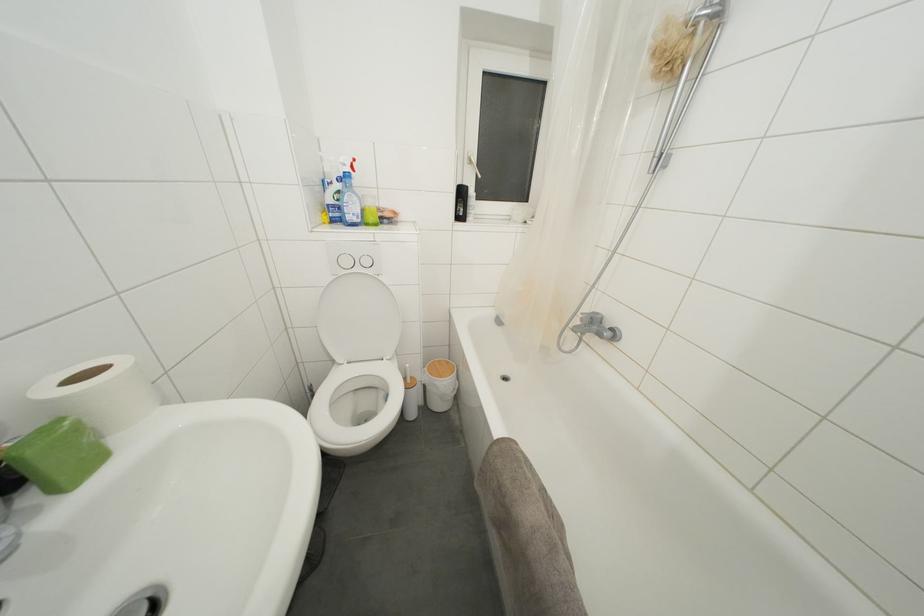
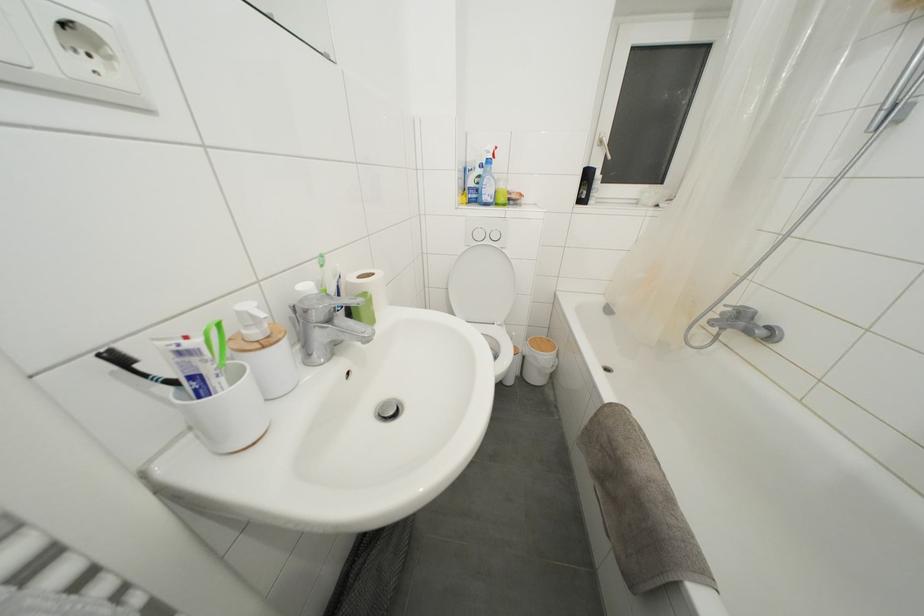
Find the pixel in the second image that matches (x=475, y=167) in the first image.

(604, 148)